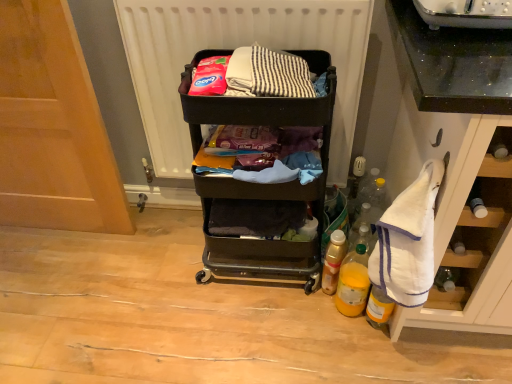
Where is `vacant area that is in front of yellow translucent bottle at lower right, arranged as the 3th bottle when viewed from the left`? vacant area that is in front of yellow translucent bottle at lower right, arranged as the 3th bottle when viewed from the left is located at coordinates (388, 357).